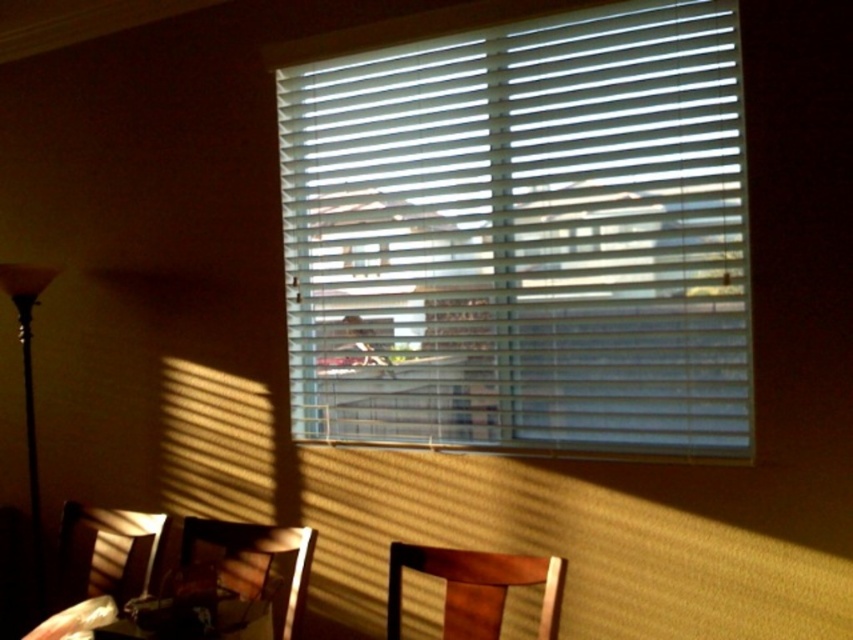
Question: Does white plastic blinds at upper center appear on the right side of wooden armchair at lower left?

Choices:
 (A) no
 (B) yes

Answer: (B)

Question: Which object is closer to the camera taking this photo?

Choices:
 (A) wooden armchair at lower left
 (B) black glass floor lamp at left

Answer: (A)

Question: Is white plastic blinds at upper center positioned behind wooden armchair at lower left?

Choices:
 (A) no
 (B) yes

Answer: (A)

Question: Estimate the real-world distances between objects in this image. Which object is closer to the black glass floor lamp at left?

Choices:
 (A) wooden armchair at lower center
 (B) wooden armchair at lower left
 (C) white plastic blinds at upper center

Answer: (B)

Question: Estimate the real-world distances between objects in this image. Which object is farther from the white plastic blinds at upper center?

Choices:
 (A) wooden armchair at lower center
 (B) wooden armchair at lower left
 (C) wooden chair at lower center
 (D) black glass floor lamp at left

Answer: (D)

Question: Can you confirm if wooden armchair at lower left is wider than wooden armchair at lower center?

Choices:
 (A) no
 (B) yes

Answer: (B)